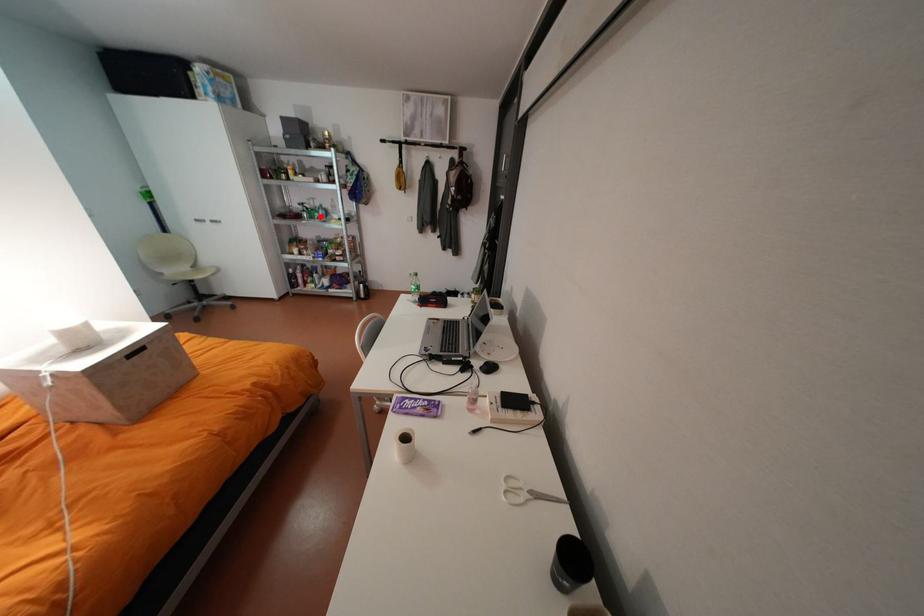
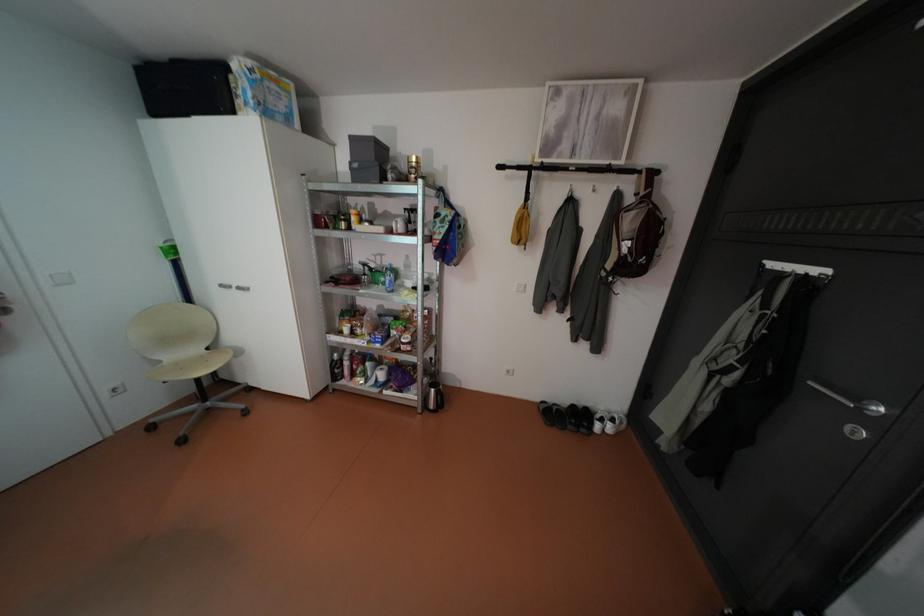
Locate, in the second image, the point that corresponds to the highlighted location in the first image.

(383, 282)